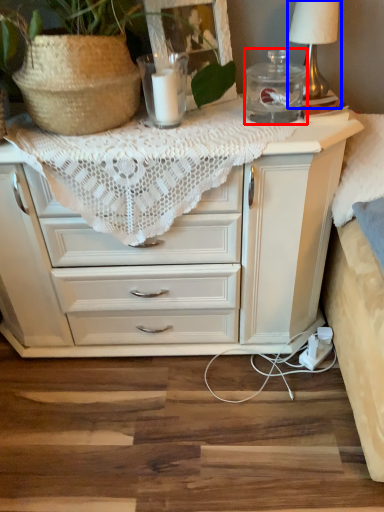
Question: Which point is further to the camera, glass jar (highlighted by a red box) or table lamp (highlighted by a blue box)?

Choices:
 (A) glass jar
 (B) table lamp

Answer: (B)